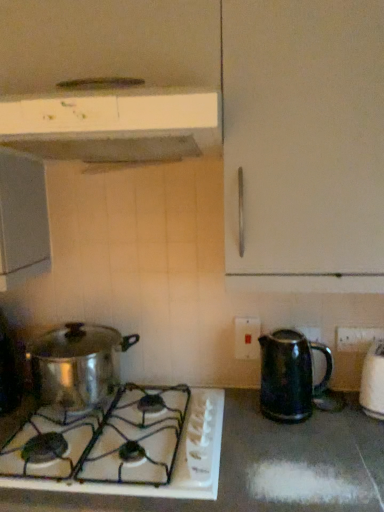
Question: Considering the relative sizes of shiny metallic pot at lower left, which is counted as the second kitchen appliance, starting from the top, and black plastic electric outlet at lower right, the 1th electric outlet when ordered from right to left, in the image provided, is shiny metallic pot at lower left, which is counted as the second kitchen appliance, starting from the top, thinner than black plastic electric outlet at lower right, the 1th electric outlet when ordered from right to left,?

Choices:
 (A) yes
 (B) no

Answer: (B)

Question: From the image's perspective, is shiny metallic pot at lower left, which is counted as the second kitchen appliance, starting from the top, above black plastic electric outlet at lower right, which ranks as the 1th electric outlet in front-to-back order?

Choices:
 (A) yes
 (B) no

Answer: (B)

Question: Would you say shiny metallic pot at lower left, which is the 2th kitchen appliance in bottom-to-top order, is outside black plastic electric outlet at lower right, which ranks as the 1th electric outlet in front-to-back order?

Choices:
 (A) no
 (B) yes

Answer: (B)

Question: Is shiny metallic pot at lower left, which is counted as the second kitchen appliance, starting from the top, further to camera compared to black plastic electric outlet at lower right, the 1th electric outlet when ordered from right to left?

Choices:
 (A) no
 (B) yes

Answer: (A)

Question: From a real-world perspective, is shiny metallic pot at lower left, which is the 2th kitchen appliance in bottom-to-top order, positioned under black plastic electric outlet at lower right, which ranks as the 1th electric outlet in front-to-back order, based on gravity?

Choices:
 (A) no
 (B) yes

Answer: (B)

Question: From the image's perspective, is white matte range hood at upper center, the 1th kitchen appliance in the top-to-bottom sequence, above or below black plastic electric outlet at lower right, the 1th electric outlet when ordered from right to left?

Choices:
 (A) below
 (B) above

Answer: (B)

Question: Considering the positions of white matte range hood at upper center, the 3th kitchen appliance from the bottom, and black plastic electric outlet at lower right, which ranks as the 1th electric outlet in front-to-back order, in the image, is white matte range hood at upper center, the 3th kitchen appliance from the bottom, wider or thinner than black plastic electric outlet at lower right, which ranks as the 1th electric outlet in front-to-back order,?

Choices:
 (A) thin
 (B) wide

Answer: (B)

Question: Is white matte range hood at upper center, the 1th kitchen appliance in the top-to-bottom sequence, inside or outside of black plastic electric outlet at lower right, which is counted as the 2th electric outlet, starting from the left?

Choices:
 (A) inside
 (B) outside

Answer: (B)

Question: From a real-world perspective, is white matte range hood at upper center, the 3th kitchen appliance from the bottom, positioned above or below black plastic electric outlet at lower right, which is counted as the 2th electric outlet, starting from the left?

Choices:
 (A) below
 (B) above

Answer: (B)

Question: Do you think white glossy gas stove at lower left is within shiny metallic pot at lower left, which is the 2th kitchen appliance in bottom-to-top order, or outside of it?

Choices:
 (A) inside
 (B) outside

Answer: (B)

Question: Would you say white glossy gas stove at lower left is to the left or to the right of shiny metallic pot at lower left, which is counted as the second kitchen appliance, starting from the top, in the picture?

Choices:
 (A) right
 (B) left

Answer: (A)

Question: Looking at their shapes, would you say white glossy gas stove at lower left is wider or thinner than shiny metallic pot at lower left, which is counted as the second kitchen appliance, starting from the top?

Choices:
 (A) thin
 (B) wide

Answer: (B)

Question: From the image's perspective, relative to shiny metallic pot at lower left, which is the 2th kitchen appliance in bottom-to-top order, is white glossy gas stove at lower left above or below?

Choices:
 (A) above
 (B) below

Answer: (B)

Question: In terms of height, does black plastic electric outlet at lower right, which appears as the 2th electric outlet when viewed from the back, look taller or shorter compared to shiny metallic kettle at right, the first kitchen appliance ordered from the bottom?

Choices:
 (A) tall
 (B) short

Answer: (B)

Question: In terms of width, does black plastic electric outlet at lower right, which is counted as the 2th electric outlet, starting from the left, look wider or thinner when compared to shiny metallic kettle at right, marked as the 3th kitchen appliance in a top-to-bottom arrangement?

Choices:
 (A) wide
 (B) thin

Answer: (B)